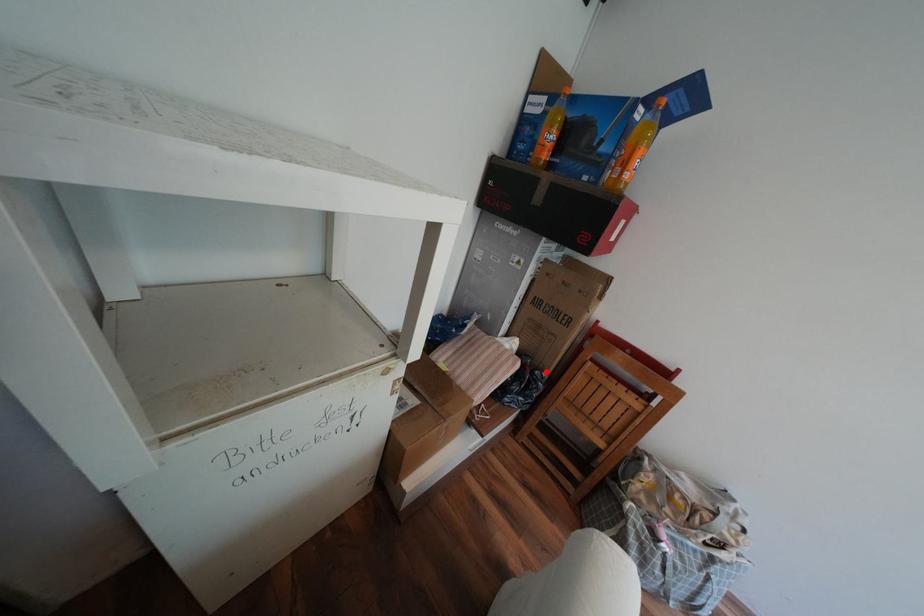
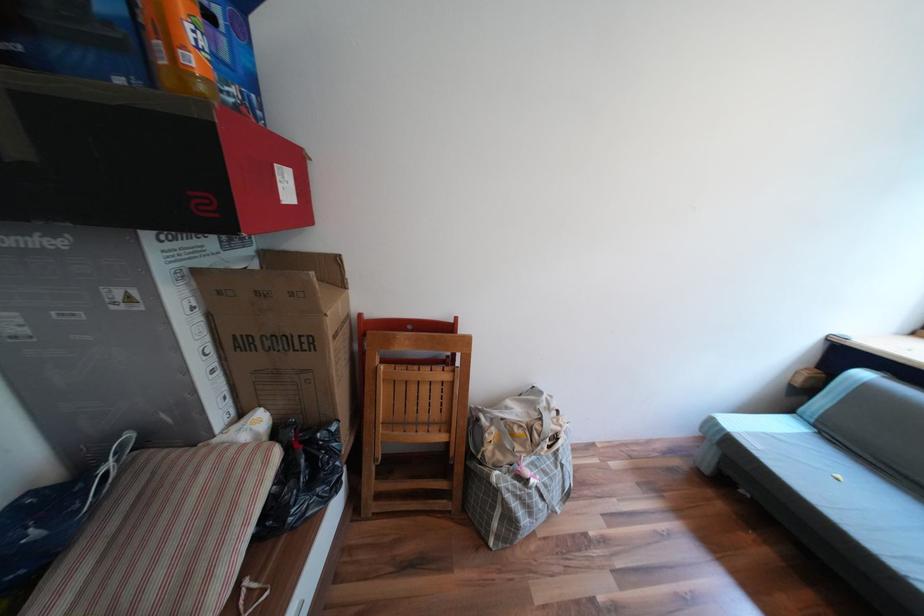
The point at the highlighted location is marked in the first image. Where is the corresponding point in the second image?

(327, 435)